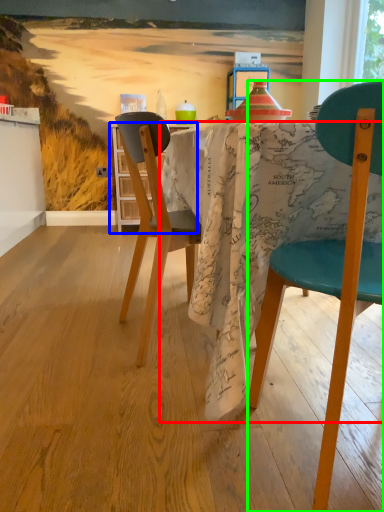
Question: Which object is positioned farthest from desk (highlighted by a red box)? Select from kitchen & dining room table (highlighted by a blue box) and chair (highlighted by a green box).

Choices:
 (A) kitchen & dining room table
 (B) chair

Answer: (A)